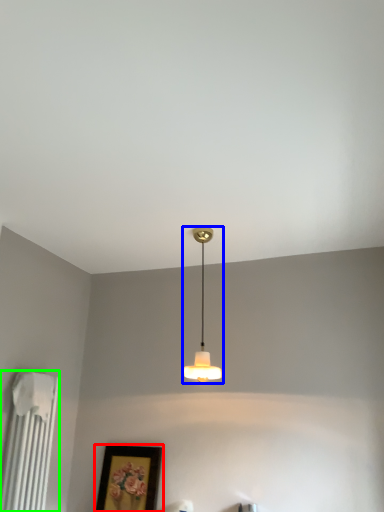
Question: Considering the real-world distances, which object is closest to picture frame (highlighted by a red box)? lamp (highlighted by a blue box) or radiator (highlighted by a green box).

Choices:
 (A) lamp
 (B) radiator

Answer: (B)